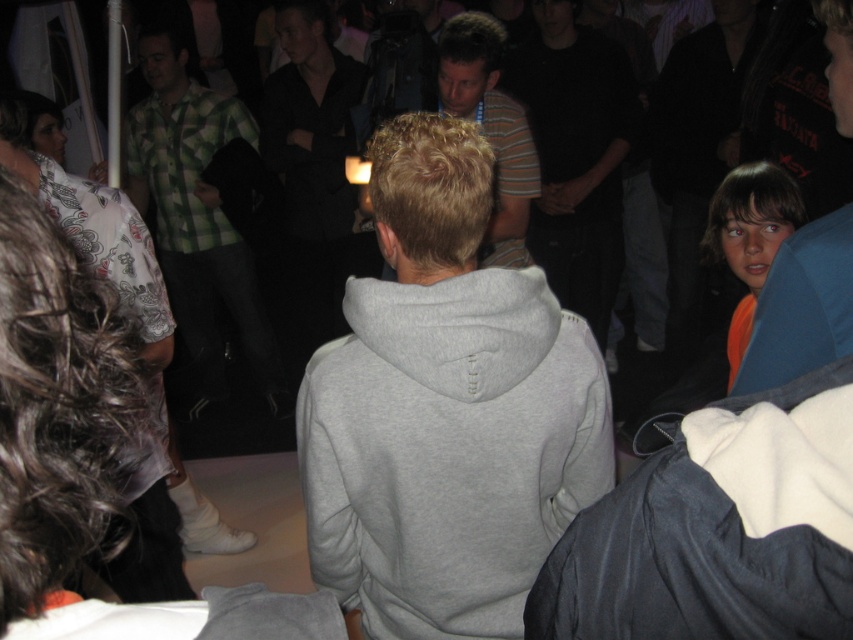
Is the position of gray hoodie at center more distant than that of striped cotton shirt at center?

No, it is not.

Is gray hoodie at center positioned in front of striped cotton shirt at center?

Yes.

Who is more forward, (463, 636) or (502, 262)?

Positioned in front is point (463, 636).

Identify the location of gray hoodie at center. This screenshot has width=853, height=640. (445, 408).

The width and height of the screenshot is (853, 640). What do you see at coordinates (491, 128) in the screenshot?
I see `striped cotton shirt at center` at bounding box center [491, 128].

Between striped cotton shirt at center and orange fabric at right, which one has more height?

Standing taller between the two is striped cotton shirt at center.

Is point (508, 264) in front of point (761, 241)?

No, it is not.

Find the location of a particular element. striped cotton shirt at center is located at coordinates (491, 128).

Locate an element on the screen. green plaid shirt at left is located at coordinates (196, 216).

Does point (229, 131) lie behind point (485, 120)?

Yes.

This screenshot has width=853, height=640. I want to click on green plaid shirt at left, so click(x=196, y=216).